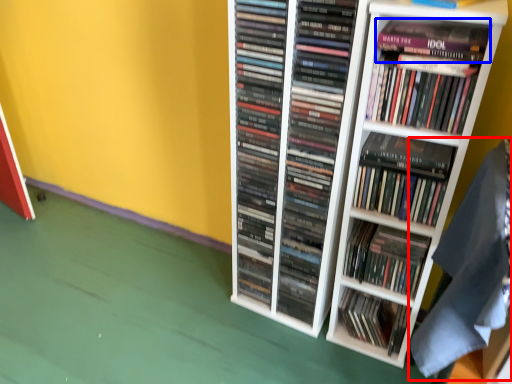
Question: Which point is closer to the camera, material (highlighted by a red box) or paperback book (highlighted by a blue box)?

Choices:
 (A) material
 (B) paperback book

Answer: (A)